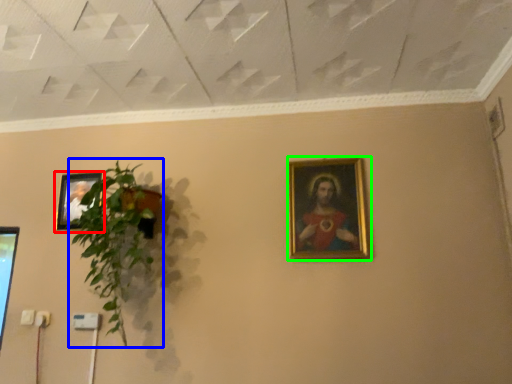
Question: Which is nearer to the picture frame (highlighted by a red box)? houseplant (highlighted by a blue box) or picture frame (highlighted by a green box).

Choices:
 (A) houseplant
 (B) picture frame

Answer: (A)